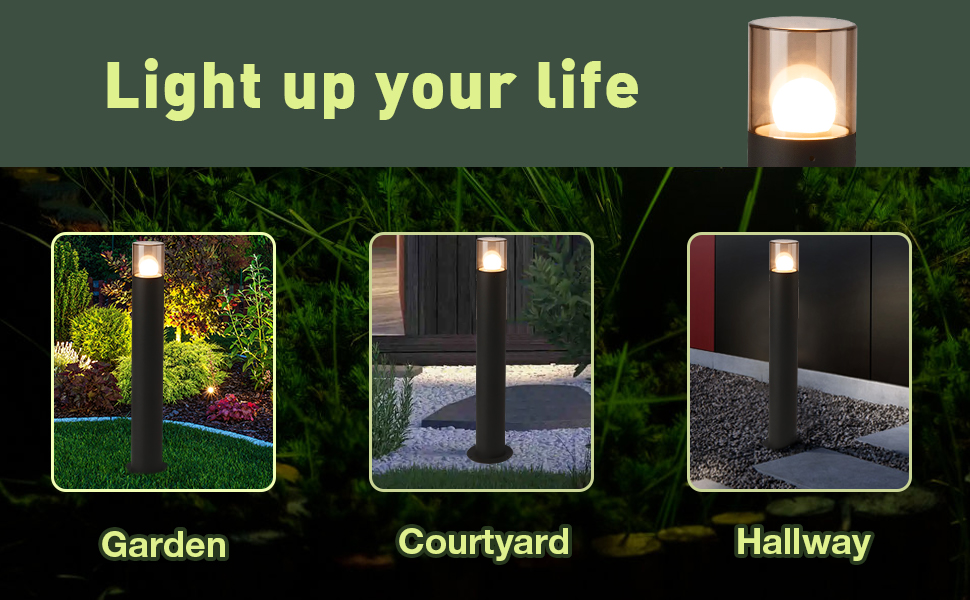
Where is `"hallway"`? "hallway" is located at coordinates (814, 537).